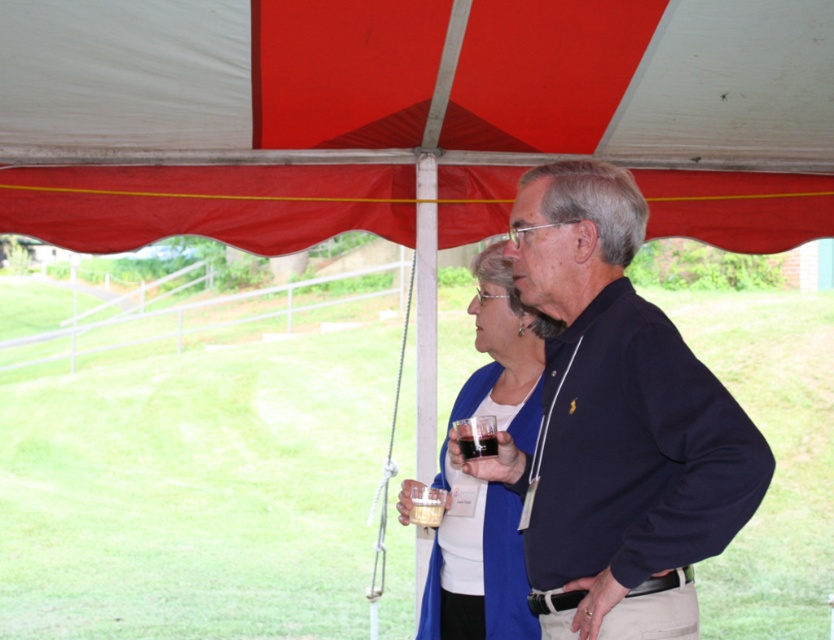
You are at a garden party and see the blue fabric sweater at center and the translucent plastic cup at lower center. Which object is positioned to the right of the other?

The blue fabric sweater at center is to the right of the translucent plastic cup at lower center.

From the picture: You are standing in front of the red and white canopy tent. There is a point marked at coordinates (215, 80). According to the scene description, which object does this point belong to?

The point at coordinates (215, 80) is on the red fabric canopy at upper center.